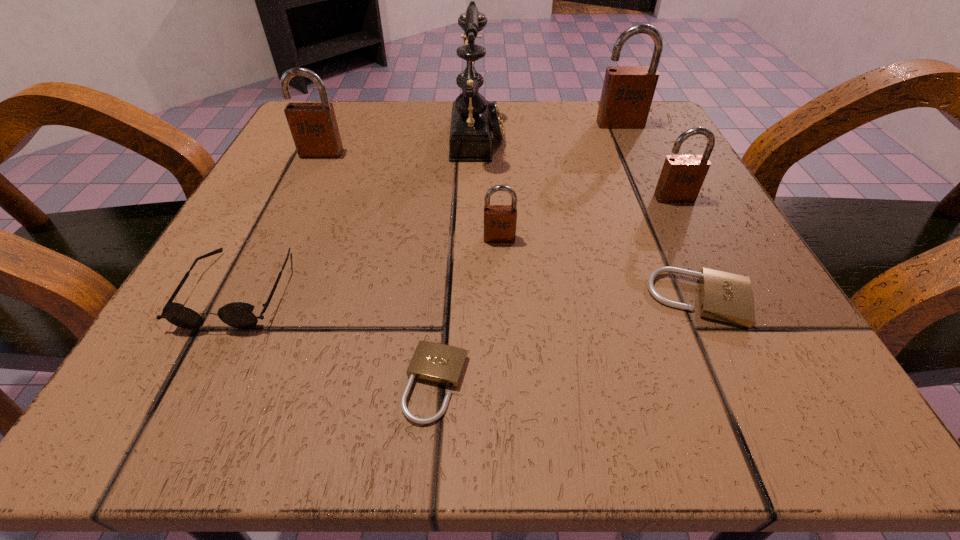
Image resolution: width=960 pixels, height=540 pixels. What are the coordinates of `black telephone` in the screenshot? It's located at (474, 119).

The image size is (960, 540). What are the coordinates of `the farthest brown padlock` in the screenshot? It's located at (627, 93).

This screenshot has height=540, width=960. What are the coordinates of `the second tallest object` in the screenshot? It's located at (627, 93).

Where is `the third smallest brown padlock`? The image size is (960, 540). the third smallest brown padlock is located at coordinates (314, 128).

Find the location of `the sixth shortest object`. the sixth shortest object is located at coordinates (314, 128).

At what (x,y) coordinates should I click in order to perform the action: click on the fifth nearest object. Please return your answer as a coordinate pair (x, y). Image resolution: width=960 pixels, height=540 pixels. Looking at the image, I should click on (682, 176).

Identify the location of the third biggest brown padlock. This screenshot has width=960, height=540. (682, 176).

You are a GUI agent. You are given a task and a screenshot of the screen. Output one action in this format:
    pyautogui.click(x=<x>, y=<y>)
    Task: Click on the fourth padlock from right to left
    The image size is (960, 540).
    Given the screenshot: What is the action you would take?
    pyautogui.click(x=500, y=221)

This screenshot has height=540, width=960. What are the coordinates of `the fourth shortest object` in the screenshot? It's located at (500, 221).

Locate an element on the screen. sunglasses is located at coordinates (239, 315).